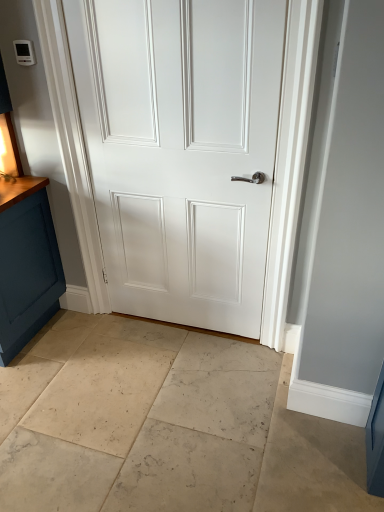
Question: Should I look upward or downward to see white matte door at center?

Choices:
 (A) up
 (B) down

Answer: (A)

Question: From the image's perspective, is white matte door at center on top of beige marble floor at center?

Choices:
 (A) yes
 (B) no

Answer: (A)

Question: Can you confirm if white matte door at center is thinner than beige marble floor at center?

Choices:
 (A) no
 (B) yes

Answer: (B)

Question: From a real-world perspective, is white matte door at center located beneath beige marble floor at center?

Choices:
 (A) yes
 (B) no

Answer: (B)

Question: Does white matte door at center turn towards beige marble floor at center?

Choices:
 (A) no
 (B) yes

Answer: (B)

Question: Is white matte door at center behind beige marble floor at center?

Choices:
 (A) no
 (B) yes

Answer: (B)

Question: Can you confirm if white matte door at center is shorter than beige marble floor at center?

Choices:
 (A) no
 (B) yes

Answer: (A)

Question: From the image's perspective, would you say beige marble floor at center is shown under white matte door at center?

Choices:
 (A) no
 (B) yes

Answer: (B)

Question: Is beige marble floor at center at the left side of white matte door at center?

Choices:
 (A) yes
 (B) no

Answer: (A)

Question: Is white matte door at center at the back of beige marble floor at center?

Choices:
 (A) no
 (B) yes

Answer: (A)

Question: Can you confirm if beige marble floor at center is smaller than white matte door at center?

Choices:
 (A) yes
 (B) no

Answer: (B)

Question: Does beige marble floor at center lie behind white matte door at center?

Choices:
 (A) no
 (B) yes

Answer: (A)

Question: From a real-world perspective, is beige marble floor at center physically below white matte door at center?

Choices:
 (A) yes
 (B) no

Answer: (A)

Question: From the image's perspective, is white matte door at center above or below beige marble floor at center?

Choices:
 (A) below
 (B) above

Answer: (B)